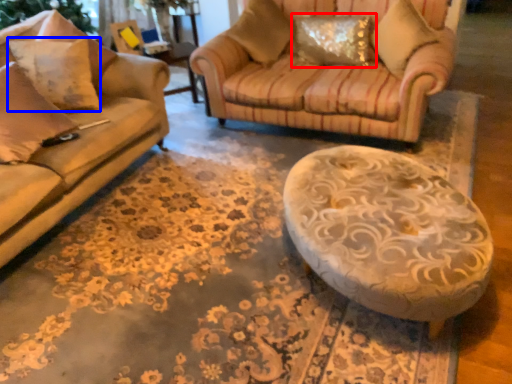
Question: Which point is further to the camera, pillow (highlighted by a red box) or pillow (highlighted by a blue box)?

Choices:
 (A) pillow
 (B) pillow

Answer: (A)